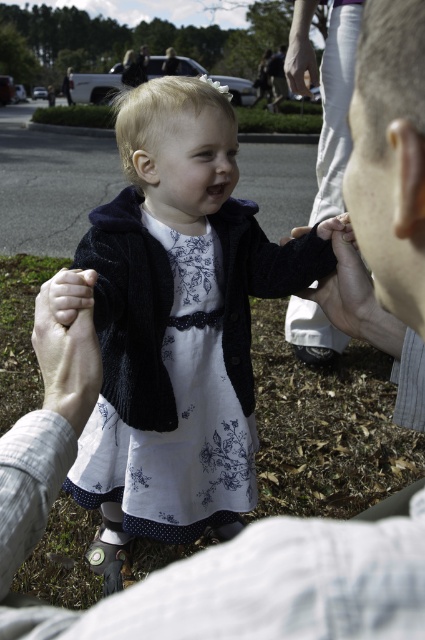
Question: Observing the image, what is the correct spatial positioning of smooth skin hand at center in reference to white smooth skin at center?

Choices:
 (A) right
 (B) left

Answer: (A)

Question: Which object is farther from the camera taking this photo?

Choices:
 (A) floral dress at center
 (B) smooth skin hand at center
 (C) white smooth skin at center

Answer: (B)

Question: From the image, what is the correct spatial relationship of floral dress at center in relation to white smooth skin at center?

Choices:
 (A) below
 (B) above

Answer: (A)

Question: In this image, where is smooth skin hand at center located relative to black fuzzy hand at center?

Choices:
 (A) above
 (B) below

Answer: (A)

Question: Among these points, which one is nearest to the camera?

Choices:
 (A) (45, 310)
 (B) (326, 141)
 (C) (300, 307)
 (D) (172, 211)

Answer: (A)

Question: Estimate the real-world distances between objects in this image. Which object is farther from the black fuzzy hand at center?

Choices:
 (A) white smooth skin at center
 (B) floral dress at center
 (C) smooth skin hand at center

Answer: (A)